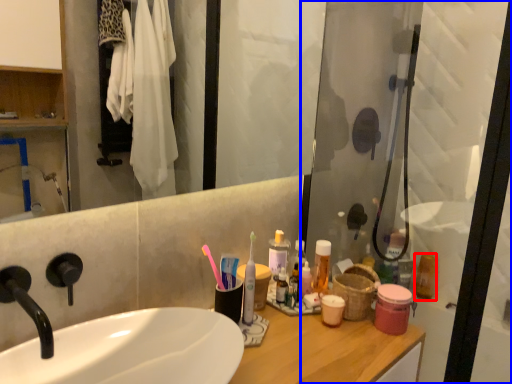
Question: Which object appears closest to the camera in this image, mouthwash (highlighted by a red box) or screen door (highlighted by a blue box)?

Choices:
 (A) mouthwash
 (B) screen door

Answer: (B)